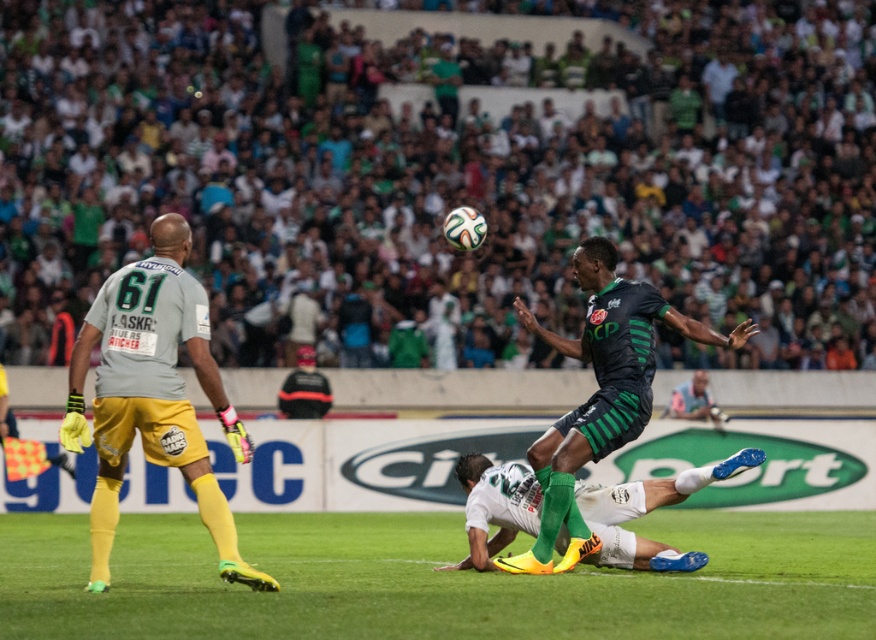
Question: Does green grass at center have a larger size compared to black matte soccer player at center?

Choices:
 (A) yes
 (B) no

Answer: (A)

Question: Which of the following is the closest to the observer?

Choices:
 (A) (369, 609)
 (B) (609, 294)

Answer: (A)

Question: Among these points, which one is nearest to the camera?

Choices:
 (A) (172, 218)
 (B) (139, 564)
 (C) (627, 556)

Answer: (A)

Question: Which point appears closest to the camera in this image?

Choices:
 (A) (602, 429)
 (B) (689, 468)

Answer: (A)

Question: Observing the image, what is the correct spatial positioning of matte gray jersey at left in reference to black matte soccer player at center?

Choices:
 (A) above
 (B) below

Answer: (A)

Question: Can you confirm if green grass at center is positioned to the right of black matte soccer player at center?

Choices:
 (A) no
 (B) yes

Answer: (A)